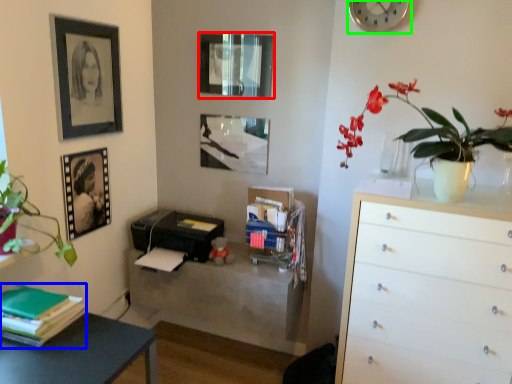
Question: Which is farther away from picture frame (highlighted by a red box)? book (highlighted by a blue box) or clock (highlighted by a green box)?

Choices:
 (A) book
 (B) clock

Answer: (A)